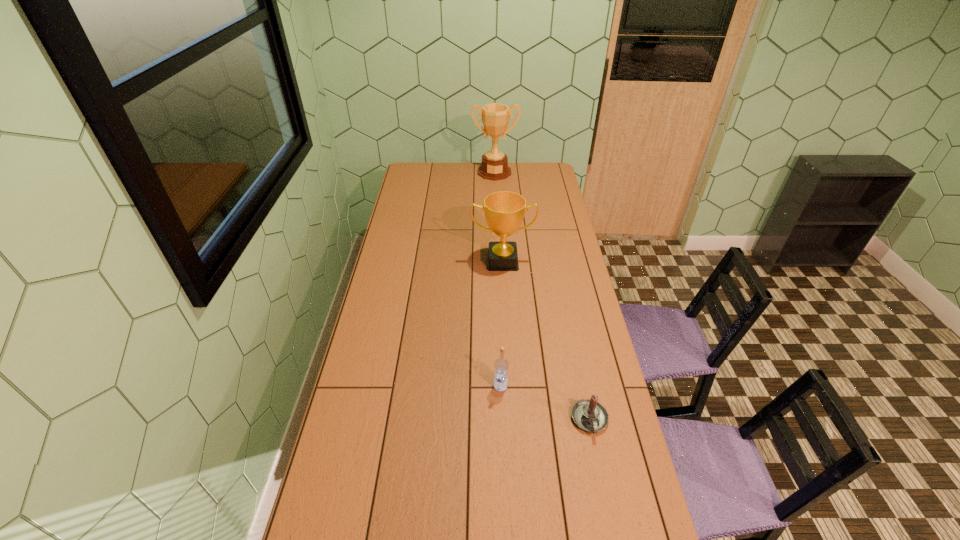
Locate an element on the screen. The width and height of the screenshot is (960, 540). the tallest object is located at coordinates (495, 117).

The height and width of the screenshot is (540, 960). Identify the location of the taller award. (495, 117).

Where is `the third nearest object`? The width and height of the screenshot is (960, 540). the third nearest object is located at coordinates pyautogui.click(x=504, y=211).

This screenshot has height=540, width=960. Identify the location of the nearer award. (504, 211).

Identify the location of vodka. The height and width of the screenshot is (540, 960). tap(501, 365).

Locate an element on the screen. This screenshot has height=540, width=960. the second shortest object is located at coordinates (501, 365).

Identify the location of the rightmost object. This screenshot has width=960, height=540. tap(588, 414).

I want to click on the shortest object, so click(x=588, y=414).

The image size is (960, 540). In order to click on vacant position located on the front-facing side of the farthest object in this screenshot , I will do point(496,219).

The width and height of the screenshot is (960, 540). Identify the location of free space located 0.090m on the front-facing side of the second tallest object. (504, 287).